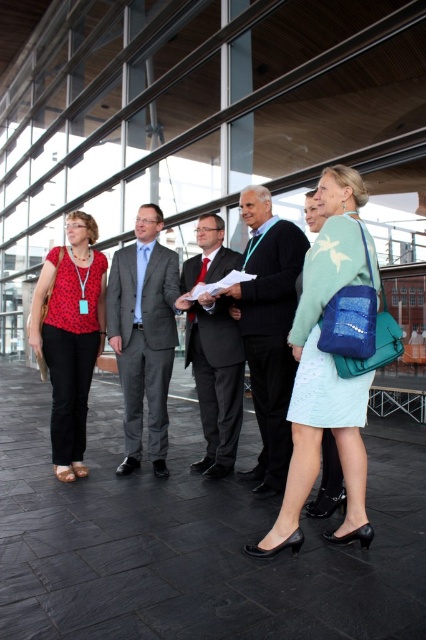
Question: Is matte red blouse at left above dark gray suit at center?

Choices:
 (A) no
 (B) yes

Answer: (B)

Question: Which is farther from the dark blue suit at center?

Choices:
 (A) gray suit at center
 (B) dark gray suit at center
 (C) matte red blouse at left
 (D) mint green fabric dress at center

Answer: (C)

Question: Which point is closer to the camera?

Choices:
 (A) matte red blouse at left
 (B) dark blue suit at center
 (C) mint green fabric dress at center

Answer: (C)

Question: Which of the following is the farthest from the observer?

Choices:
 (A) (124, 324)
 (B) (299, 452)
 (C) (244, 221)
 (D) (89, 374)

Answer: (C)

Question: Is mint green fabric dress at center to the right of dark blue suit at center from the viewer's perspective?

Choices:
 (A) no
 (B) yes

Answer: (B)

Question: Can you confirm if gray suit at center is bigger than dark gray suit at center?

Choices:
 (A) no
 (B) yes

Answer: (B)